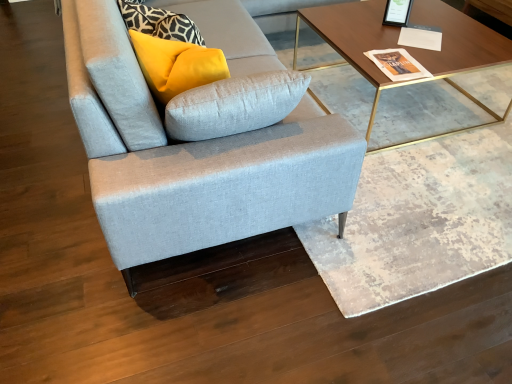
Measure the distance between point [296,68] and camera.

They are 2.76 meters apart.

The width and height of the screenshot is (512, 384). What do you see at coordinates (408, 47) in the screenshot? I see `wooden/golden metal legs coffee table at upper right` at bounding box center [408, 47].

The height and width of the screenshot is (384, 512). In order to click on wooden/golden metal legs coffee table at upper right in this screenshot , I will do `click(408, 47)`.

Which is nearer, (138, 248) or (188, 66)?

Point (138, 248)

Measure the distance from light gray fabric couch at center to matte yellow pillow at upper left.

A distance of 9.03 inches exists between light gray fabric couch at center and matte yellow pillow at upper left.

In order to click on studio couch that is under the matte yellow pillow at upper left (from a real-world perspective) in this screenshot , I will do `click(200, 139)`.

Who is shorter, light gray fabric couch at center or matte yellow pillow at upper left?

With less height is matte yellow pillow at upper left.

Which object is closer to the camera taking this photo, wooden/golden metal legs coffee table at upper right or matte yellow pillow at upper left?

Positioned in front is matte yellow pillow at upper left.

In the scene shown: Does wooden/golden metal legs coffee table at upper right appear on the right side of matte yellow pillow at upper left?

Correct, you'll find wooden/golden metal legs coffee table at upper right to the right of matte yellow pillow at upper left.

Is wooden/golden metal legs coffee table at upper right placed right next to matte yellow pillow at upper left?

No, wooden/golden metal legs coffee table at upper right is not with matte yellow pillow at upper left.

Can we say matte yellow pillow at upper left lies outside wooden/golden metal legs coffee table at upper right?

Indeed, matte yellow pillow at upper left is completely outside wooden/golden metal legs coffee table at upper right.

Is point (181, 57) closer to camera compared to point (327, 18)?

Yes, it is.

Which is in front, matte yellow pillow at upper left or wooden/golden metal legs coffee table at upper right?

matte yellow pillow at upper left is closer to the camera.

Which is more to the right, matte yellow pillow at upper left or wooden/golden metal legs coffee table at upper right?

From the viewer's perspective, wooden/golden metal legs coffee table at upper right appears more on the right side.

Is matte yellow pillow at upper left turned away from light gray fabric couch at center?

Yes, matte yellow pillow at upper left's orientation is away from light gray fabric couch at center.

From a real-world perspective, is matte yellow pillow at upper left located higher than light gray fabric couch at center?

Yes, from a real-world perspective, matte yellow pillow at upper left is over light gray fabric couch at center

Are matte yellow pillow at upper left and light gray fabric couch at center beside each other?

They are not placed beside each other.

Locate an element on the screen. This screenshot has width=512, height=384. pillow above the light gray fabric couch at center (from the image's perspective) is located at coordinates (176, 65).

How different are the orientations of light gray fabric couch at center and wooden/golden metal legs coffee table at upper right in degrees?

They differ by 0.945 degrees in their facing directions.

From a real-world perspective, who is located lower, light gray fabric couch at center or wooden/golden metal legs coffee table at upper right?

wooden/golden metal legs coffee table at upper right.

Is light gray fabric couch at center directly adjacent to wooden/golden metal legs coffee table at upper right?

They are not placed beside each other.

Identify the location of studio couch lying in front of the wooden/golden metal legs coffee table at upper right. (200, 139).

Does wooden/golden metal legs coffee table at upper right come in front of light gray fabric couch at center?

No, it is not.

Considering the relative sizes of wooden/golden metal legs coffee table at upper right and light gray fabric couch at center in the image provided, is wooden/golden metal legs coffee table at upper right shorter than light gray fabric couch at center?

Yes.

From the image's perspective, does wooden/golden metal legs coffee table at upper right appear lower than light gray fabric couch at center?

No, from the image's perspective, wooden/golden metal legs coffee table at upper right is not beneath light gray fabric couch at center.

From a real-world perspective, is wooden/golden metal legs coffee table at upper right physically above light gray fabric couch at center?

Actually, wooden/golden metal legs coffee table at upper right is physically below light gray fabric couch at center in the real world.

You are a GUI agent. You are given a task and a screenshot of the screen. Output one action in this format:
    pyautogui.click(x=<x>, y=<y>)
    Task: Click on the studio couch directly beneath the matte yellow pillow at upper left (from a real-world perspective)
    The width and height of the screenshot is (512, 384).
    Given the screenshot: What is the action you would take?
    pyautogui.click(x=200, y=139)

Where is `pillow positioned vertically above the wooden/golden metal legs coffee table at upper right (from a real-world perspective)`? This screenshot has width=512, height=384. pillow positioned vertically above the wooden/golden metal legs coffee table at upper right (from a real-world perspective) is located at coordinates (176, 65).

Looking at the image, which one is located further to matte yellow pillow at upper left, light gray fabric couch at center or wooden/golden metal legs coffee table at upper right?

The object further to matte yellow pillow at upper left is wooden/golden metal legs coffee table at upper right.

Which object lies further to the anchor point wooden/golden metal legs coffee table at upper right, light gray fabric couch at center or matte yellow pillow at upper left?

matte yellow pillow at upper left is further to wooden/golden metal legs coffee table at upper right.

Estimate the real-world distances between objects in this image. Which object is further from light gray fabric couch at center, matte yellow pillow at upper left or wooden/golden metal legs coffee table at upper right?

Based on the image, wooden/golden metal legs coffee table at upper right appears to be further to light gray fabric couch at center.

Estimate the real-world distances between objects in this image. Which object is closer to light gray fabric couch at center, wooden/golden metal legs coffee table at upper right or matte yellow pillow at upper left?

matte yellow pillow at upper left.

Considering their positions, is wooden/golden metal legs coffee table at upper right positioned further to matte yellow pillow at upper left than light gray fabric couch at center?

wooden/golden metal legs coffee table at upper right lies further to matte yellow pillow at upper left than the other object.

Based on their spatial positions, is matte yellow pillow at upper left or light gray fabric couch at center further from wooden/golden metal legs coffee table at upper right?

matte yellow pillow at upper left lies further to wooden/golden metal legs coffee table at upper right than the other object.

At what (x,y) coordinates should I click in order to perform the action: click on studio couch between matte yellow pillow at upper left and wooden/golden metal legs coffee table at upper right. Please return your answer as a coordinate pair (x, y). The height and width of the screenshot is (384, 512). Looking at the image, I should click on (200, 139).